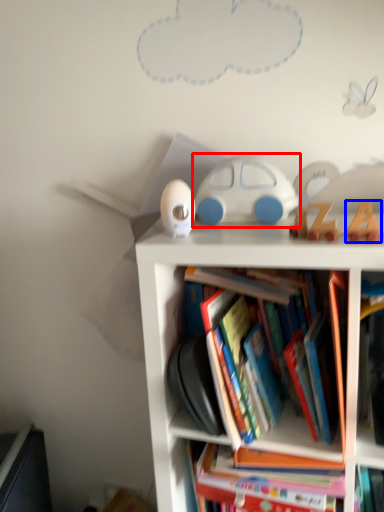
Question: Which object appears closest to the camera in this image, toy (highlighted by a red box) or toy (highlighted by a blue box)?

Choices:
 (A) toy
 (B) toy

Answer: (B)